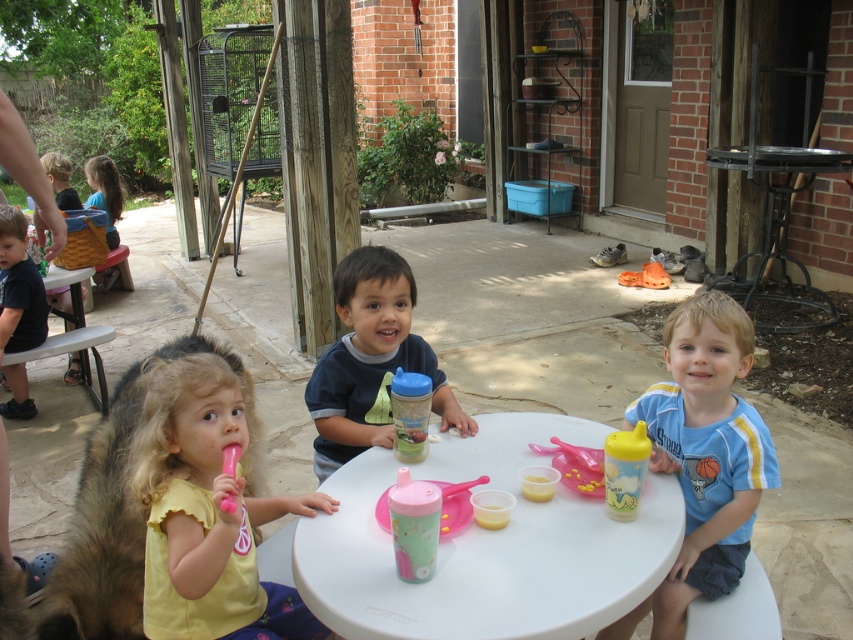
Question: Is yellow rubber sippy cup at center closer to the viewer compared to black metal picnic table at right?

Choices:
 (A) yes
 (B) no

Answer: (A)

Question: Which of these objects is positioned closest to the white plastic table at center?

Choices:
 (A) blonde hair at left
 (B) black metal picnic table at right
 (C) yellow fabric shirt at center

Answer: (C)

Question: Which of the following is the closest to the observer?

Choices:
 (A) (119, 212)
 (B) (543, 468)
 (C) (283, 630)

Answer: (B)

Question: Is yellow fabric shirt at center smaller than yellow plastic cup at center?

Choices:
 (A) no
 (B) yes

Answer: (A)

Question: Is white plastic table at center thinner than blonde hair at left?

Choices:
 (A) yes
 (B) no

Answer: (B)

Question: Among these points, which one is nearest to the camera?

Choices:
 (A) (115, 211)
 (B) (677, 358)

Answer: (B)